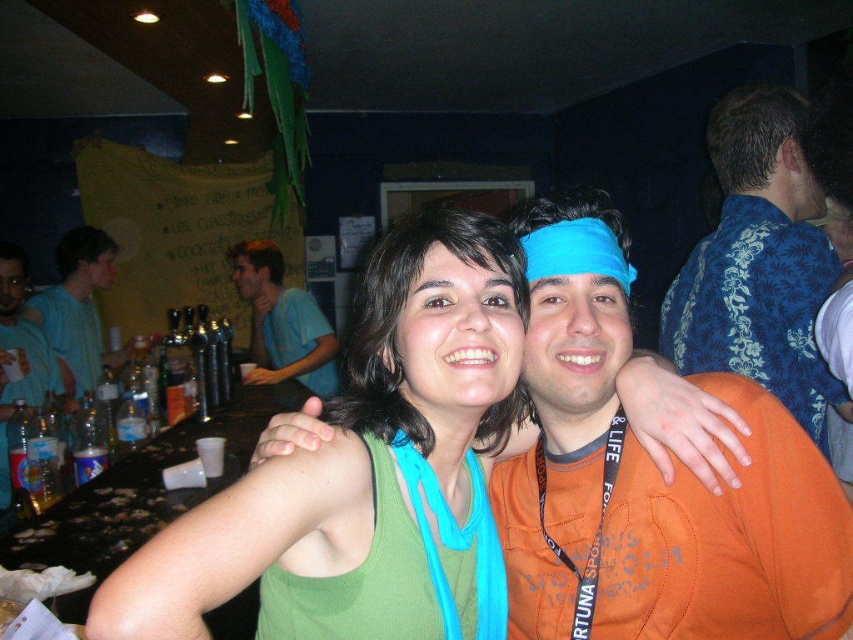
Who is positioned more to the left, matte blue shirt at left or black fabric lanyard at upper center?

matte blue shirt at left

Can you confirm if matte blue shirt at left is shorter than black fabric lanyard at upper center?

Incorrect, matte blue shirt at left's height does not fall short of black fabric lanyard at upper center's.

Find the location of a particular element. matte blue shirt at left is located at coordinates (80, 308).

Is point (677, 506) farther from viewer compared to point (328, 362)?

No, (677, 506) is in front of (328, 362).

Is orange cotton shirt at center to the right of blue cotton shirt at center from the viewer's perspective?

Yes, orange cotton shirt at center is to the right of blue cotton shirt at center.

Is point (556, 625) positioned behind point (282, 342)?

No, it is in front of (282, 342).

You are a GUI agent. You are given a task and a screenshot of the screen. Output one action in this format:
    pyautogui.click(x=<x>, y=<y>)
    Task: Click on the orange cotton shirt at center
    This screenshot has width=853, height=640.
    Given the screenshot: What is the action you would take?
    pyautogui.click(x=654, y=472)

Which is behind, point (402, 474) or point (537, 467)?

The point (537, 467) is behind.

From the picture: Is blue fabric lanyard at upper center positioned behind black fabric lanyard at upper center?

That is False.

Locate an element on the screen. blue fabric lanyard at upper center is located at coordinates (457, 540).

Locate an element on the screen. This screenshot has height=640, width=853. blue fabric lanyard at upper center is located at coordinates (457, 540).